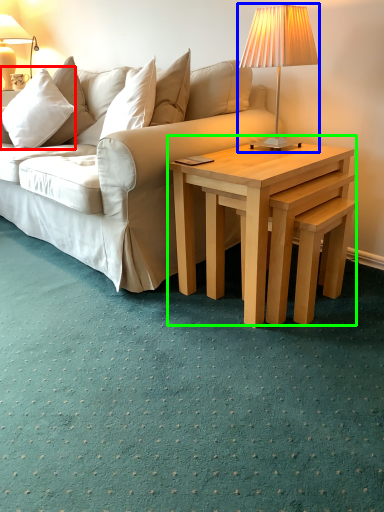
Question: Estimate the real-world distances between objects in this image. Which object is closer to pillow (highlighted by a red box), lamp (highlighted by a blue box) or coffee table (highlighted by a green box)?

Choices:
 (A) lamp
 (B) coffee table

Answer: (A)